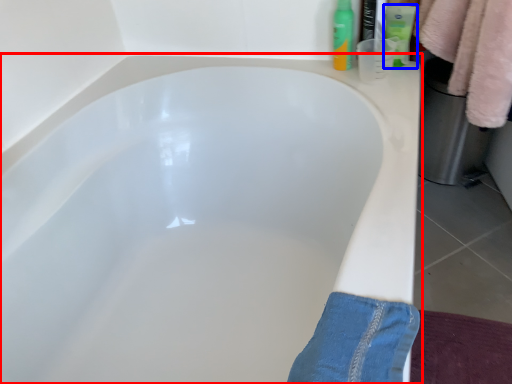
Question: Which point is further to the camera, bathtub (highlighted by a red box) or toiletry (highlighted by a blue box)?

Choices:
 (A) bathtub
 (B) toiletry

Answer: (B)